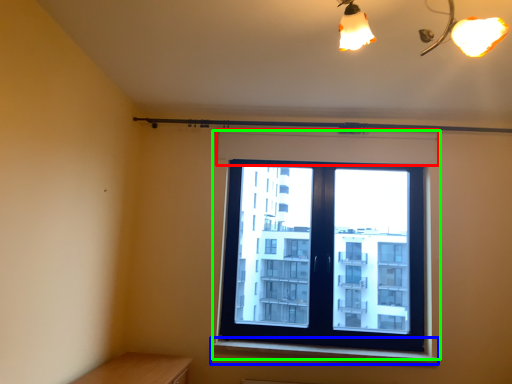
Question: Which is nearer to the shutter (highlighted by a red box)? window sill (highlighted by a blue box) or window (highlighted by a green box).

Choices:
 (A) window sill
 (B) window

Answer: (B)